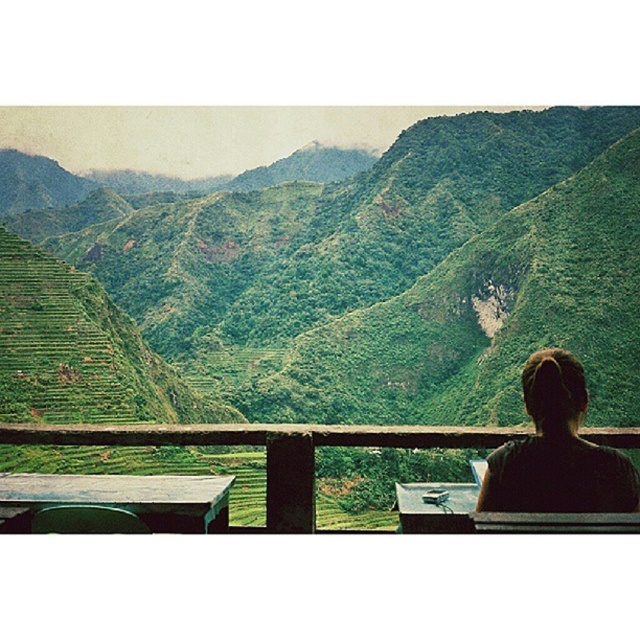
Question: Does wooden table at lower left have a greater width compared to wooden table at center?

Choices:
 (A) no
 (B) yes

Answer: (B)

Question: In this image, where is dark brown hair at upper right located relative to wooden at center?

Choices:
 (A) right
 (B) left

Answer: (A)

Question: Among these objects, which one is nearest to the camera?

Choices:
 (A) wooden table at center
 (B) wooden at center
 (C) dark brown hair at upper right

Answer: (A)

Question: Which object is positioned closest to the wooden table at lower left?

Choices:
 (A) wooden at center
 (B) wooden table at center
 (C) dark brown hair at upper right

Answer: (A)

Question: Is wooden at center below wooden table at center?

Choices:
 (A) no
 (B) yes

Answer: (A)

Question: Among these points, which one is farthest from the camera?

Choices:
 (A) (92, 476)
 (B) (545, 480)
 (C) (458, 522)
 (D) (90, 444)

Answer: (A)